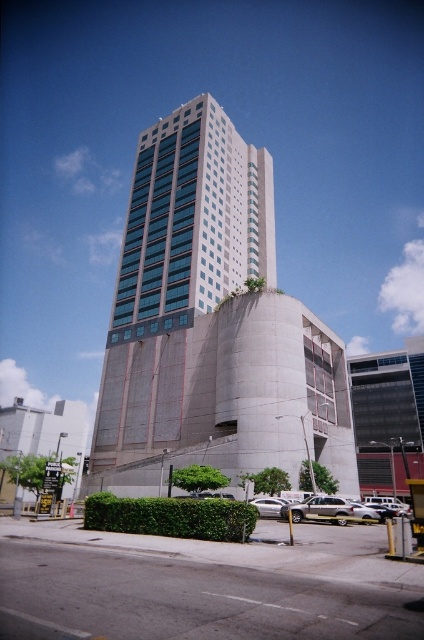
The width and height of the screenshot is (424, 640). Describe the element at coordinates (212, 323) in the screenshot. I see `concrete building at center` at that location.

Is the position of concrete building at center less distant than that of matte concrete building at lower left?

No, concrete building at center is behind matte concrete building at lower left.

Does point (200, 461) lie in front of point (39, 449)?

That is True.

This screenshot has height=640, width=424. I want to click on concrete building at center, so click(x=212, y=323).

Who is taller, green leafy hedge at lower center or matte concrete building at lower left?

With more height is matte concrete building at lower left.

Does green leafy hedge at lower center have a larger size compared to matte concrete building at lower left?

No.

What are the coordinates of `green leafy hedge at lower center` in the screenshot? It's located at pyautogui.click(x=170, y=516).

Who is taller, concrete building at center or green leafy hedge at lower center?

Standing taller between the two is concrete building at center.

Who is more forward, (181, 326) or (219, 522)?

Point (219, 522)

Locate an element on the screen. concrete building at center is located at coordinates (212, 323).